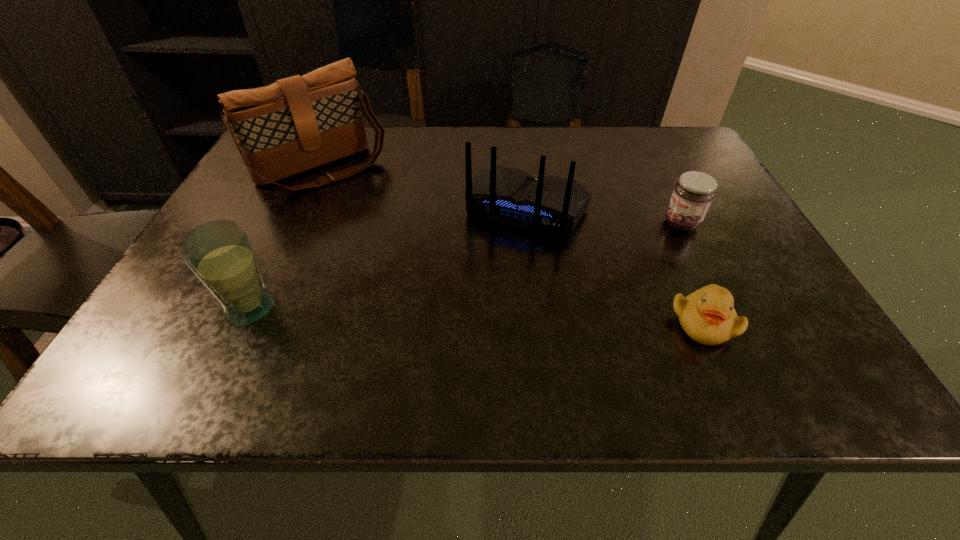
This screenshot has width=960, height=540. I want to click on glass, so click(x=220, y=253).

This screenshot has height=540, width=960. Find the location of `the shortest object`. the shortest object is located at coordinates (707, 316).

Locate an element on the screen. jam is located at coordinates (693, 194).

Find the location of `the tallest object`. the tallest object is located at coordinates (296, 124).

I want to click on router, so point(512,197).

Where is `vacant space located 0.340m on the right of the glass`? vacant space located 0.340m on the right of the glass is located at coordinates (465, 308).

The height and width of the screenshot is (540, 960). I want to click on free location located on the front label of the jam, so click(x=605, y=257).

Find the location of a particular element. free space located 0.390m on the front label of the jam is located at coordinates (517, 295).

This screenshot has width=960, height=540. Find the location of `free space located on the front label of the jam`. free space located on the front label of the jam is located at coordinates (x=536, y=287).

Where is `vacant space located on the front-facing side of the tallest object`? This screenshot has width=960, height=540. vacant space located on the front-facing side of the tallest object is located at coordinates (x=420, y=261).